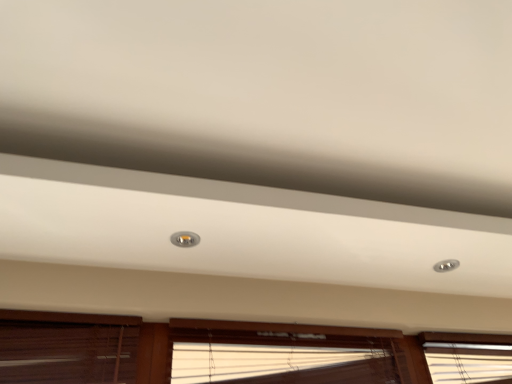
Locate an element on the screen. The height and width of the screenshot is (384, 512). matte silver droplight at center is located at coordinates (185, 239).

Locate an element on the screen. This screenshot has height=384, width=512. matte silver droplight at center is located at coordinates point(185,239).

From a real-world perspective, which object rests below the other?

brown wood blinds at lower left, placed as the 1th window when sorted from left to right, from a real-world perspective.

Are brown wood blinds at lower left, placed as the 1th window when sorted from left to right, and wooden blinds at lower center, placed as the 3th window when sorted from left to right, far apart?

No, brown wood blinds at lower left, placed as the 1th window when sorted from left to right, is in close proximity to wooden blinds at lower center, placed as the 3th window when sorted from left to right.

In the scene shown: Who is shorter, brown wood blinds at lower left, placed as the 1th window when sorted from left to right, or wooden blinds at lower center, placed as the 3th window when sorted from left to right?

brown wood blinds at lower left, placed as the 1th window when sorted from left to right, is shorter.

How many degrees apart are the facing directions of brown wood blinds at lower left, positioned as the 3th window in right-to-left order, and wooden blinds at lower center, which is the first window from right to left?

brown wood blinds at lower left, positioned as the 3th window in right-to-left order, and wooden blinds at lower center, which is the first window from right to left, are facing 1.13 degrees away from each other.

Could you tell me if matte silver droplight at center is facing translucent bamboo blinds at lower center, acting as the second window starting from the right?

No, matte silver droplight at center is not aimed at translucent bamboo blinds at lower center, acting as the second window starting from the right.

Looking at this image, in terms of size, does matte silver droplight at center appear bigger or smaller than translucent bamboo blinds at lower center, the 2th window positioned from the left?

Clearly, matte silver droplight at center is smaller in size than translucent bamboo blinds at lower center, the 2th window positioned from the left.

From a real-world perspective, is matte silver droplight at center positioned above or below translucent bamboo blinds at lower center, the 2th window positioned from the left?

In terms of real-world spatial position, matte silver droplight at center is above translucent bamboo blinds at lower center, the 2th window positioned from the left.

Would you say translucent bamboo blinds at lower center, acting as the second window starting from the right, is part of matte silver droplight at center's contents?

No, translucent bamboo blinds at lower center, acting as the second window starting from the right, is located outside of matte silver droplight at center.

Is there a large distance between translucent bamboo blinds at lower center, acting as the second window starting from the right, and wooden blinds at lower center, which is the first window from right to left?

No, translucent bamboo blinds at lower center, acting as the second window starting from the right, is in close proximity to wooden blinds at lower center, which is the first window from right to left.

Can you confirm if translucent bamboo blinds at lower center, acting as the second window starting from the right, is thinner than wooden blinds at lower center, which is the first window from right to left?

No.

Considering the relative sizes of translucent bamboo blinds at lower center, acting as the second window starting from the right, and wooden blinds at lower center, which is the first window from right to left, in the image provided, is translucent bamboo blinds at lower center, acting as the second window starting from the right, smaller than wooden blinds at lower center, which is the first window from right to left,?

Yes, translucent bamboo blinds at lower center, acting as the second window starting from the right, is smaller than wooden blinds at lower center, which is the first window from right to left.

Does translucent bamboo blinds at lower center, acting as the second window starting from the right, have a lesser height compared to wooden blinds at lower center, which is the first window from right to left?

Correct, translucent bamboo blinds at lower center, acting as the second window starting from the right, is not as tall as wooden blinds at lower center, which is the first window from right to left.

Based on the photo, considering the relative sizes of translucent bamboo blinds at lower center, the 2th window positioned from the left, and brown wood blinds at lower left, positioned as the 3th window in right-to-left order, in the image provided, is translucent bamboo blinds at lower center, the 2th window positioned from the left, smaller than brown wood blinds at lower left, positioned as the 3th window in right-to-left order,?

No.

Consider the image. Is translucent bamboo blinds at lower center, acting as the second window starting from the right, looking in the opposite direction of brown wood blinds at lower left, positioned as the 3th window in right-to-left order?

Result: No, brown wood blinds at lower left, positioned as the 3th window in right-to-left order, is not at the back of translucent bamboo blinds at lower center, acting as the second window starting from the right.

Can you tell me how much translucent bamboo blinds at lower center, acting as the second window starting from the right, and brown wood blinds at lower left, placed as the 1th window when sorted from left to right, differ in facing direction?

The facing directions of translucent bamboo blinds at lower center, acting as the second window starting from the right, and brown wood blinds at lower left, placed as the 1th window when sorted from left to right, are 0.00182 degrees apart.

Which object is more forward, translucent bamboo blinds at lower center, acting as the second window starting from the right, or brown wood blinds at lower left, placed as the 1th window when sorted from left to right?

brown wood blinds at lower left, placed as the 1th window when sorted from left to right, is in front.

In the scene shown: From the image's perspective, which is below, wooden blinds at lower center, which is the first window from right to left, or translucent bamboo blinds at lower center, the 2th window positioned from the left?

translucent bamboo blinds at lower center, the 2th window positioned from the left, is shown below in the image.

Where is `the 2nd window above the translucent bamboo blinds at lower center, the 2th window positioned from the left (from a real-world perspective)`? This screenshot has width=512, height=384. the 2nd window above the translucent bamboo blinds at lower center, the 2th window positioned from the left (from a real-world perspective) is located at coordinates (236, 352).

Is point (188, 322) positioned after point (199, 332)?

No.

Is wooden blinds at lower center, placed as the 3th window when sorted from left to right, facing away from translucent bamboo blinds at lower center, acting as the second window starting from the right?

Yes, wooden blinds at lower center, placed as the 3th window when sorted from left to right, is facing away from translucent bamboo blinds at lower center, acting as the second window starting from the right.

Is matte silver droplight at center wider than wooden blinds at lower center, placed as the 3th window when sorted from left to right?

Correct, the width of matte silver droplight at center exceeds that of wooden blinds at lower center, placed as the 3th window when sorted from left to right.

Looking at this image, from a real-world perspective, which object stands above the other?

matte silver droplight at center is physically above.

Which of these two, matte silver droplight at center or wooden blinds at lower center, which is the first window from right to left, is bigger?

Bigger between the two is wooden blinds at lower center, which is the first window from right to left.

Between matte silver droplight at center and wooden blinds at lower center, which is the first window from right to left, which one is positioned behind?

Positioned behind is matte silver droplight at center.

Which point is more forward, (9, 340) or (175, 240)?

The point (9, 340) is in front.

In the scene shown: From the image's perspective, between wooden blinds at lower center, placed as the 3th window when sorted from left to right, and matte silver droplight at center, who is located below?

wooden blinds at lower center, placed as the 3th window when sorted from left to right, appears lower in the image.

You are a GUI agent. You are given a task and a screenshot of the screen. Output one action in this format:
    pyautogui.click(x=<x>, y=<y>)
    Task: Click on the 2nd window counting from the right side of the brown wood blinds at lower left, placed as the 1th window when sorted from left to right
    The width and height of the screenshot is (512, 384).
    Given the screenshot: What is the action you would take?
    pyautogui.click(x=236, y=352)

In order to click on window behind the matte silver droplight at center in this screenshot , I will do `click(284, 353)`.

Looking at the image, which one is located further to wooden blinds at lower center, which is the first window from right to left, translucent bamboo blinds at lower center, acting as the second window starting from the right, or matte silver droplight at center?

matte silver droplight at center is further to wooden blinds at lower center, which is the first window from right to left.

From the image, which object appears to be farther from translucent bamboo blinds at lower center, the 2th window positioned from the left, matte silver droplight at center or brown wood blinds at lower left, placed as the 1th window when sorted from left to right?

matte silver droplight at center is positioned further to the anchor translucent bamboo blinds at lower center, the 2th window positioned from the left.

Looking at the image, which one is located further to brown wood blinds at lower left, placed as the 1th window when sorted from left to right, wooden blinds at lower center, placed as the 3th window when sorted from left to right, or translucent bamboo blinds at lower center, acting as the second window starting from the right?

Based on the image, translucent bamboo blinds at lower center, acting as the second window starting from the right, appears to be further to brown wood blinds at lower left, placed as the 1th window when sorted from left to right.

When comparing their distances from brown wood blinds at lower left, placed as the 1th window when sorted from left to right, does matte silver droplight at center or wooden blinds at lower center, placed as the 3th window when sorted from left to right, seem closer?

wooden blinds at lower center, placed as the 3th window when sorted from left to right.

When comparing their distances from matte silver droplight at center, does wooden blinds at lower center, placed as the 3th window when sorted from left to right, or translucent bamboo blinds at lower center, acting as the second window starting from the right, seem closer?

Among the two, translucent bamboo blinds at lower center, acting as the second window starting from the right, is located nearer to matte silver droplight at center.

Which object lies further to the anchor point matte silver droplight at center, translucent bamboo blinds at lower center, the 2th window positioned from the left, or brown wood blinds at lower left, placed as the 1th window when sorted from left to right?

Based on the image, translucent bamboo blinds at lower center, the 2th window positioned from the left, appears to be further to matte silver droplight at center.

When comparing their distances from matte silver droplight at center, does wooden blinds at lower center, placed as the 3th window when sorted from left to right, or brown wood blinds at lower left, placed as the 1th window when sorted from left to right, seem further?

The object further to matte silver droplight at center is wooden blinds at lower center, placed as the 3th window when sorted from left to right.

Looking at the image, which one is located closer to brown wood blinds at lower left, positioned as the 3th window in right-to-left order, translucent bamboo blinds at lower center, acting as the second window starting from the right, or matte silver droplight at center?

translucent bamboo blinds at lower center, acting as the second window starting from the right, is positioned closer to the anchor brown wood blinds at lower left, positioned as the 3th window in right-to-left order.

The height and width of the screenshot is (384, 512). What are the coordinates of `window situated between brown wood blinds at lower left, placed as the 1th window when sorted from left to right, and wooden blinds at lower center, which is the first window from right to left, from left to right` in the screenshot? It's located at [x=284, y=353].

I want to click on droplight between brown wood blinds at lower left, placed as the 1th window when sorted from left to right, and wooden blinds at lower center, placed as the 3th window when sorted from left to right, so click(185, 239).

Identify the location of droplight between brown wood blinds at lower left, placed as the 1th window when sorted from left to right, and translucent bamboo blinds at lower center, acting as the second window starting from the right, from left to right. The height and width of the screenshot is (384, 512). (185, 239).